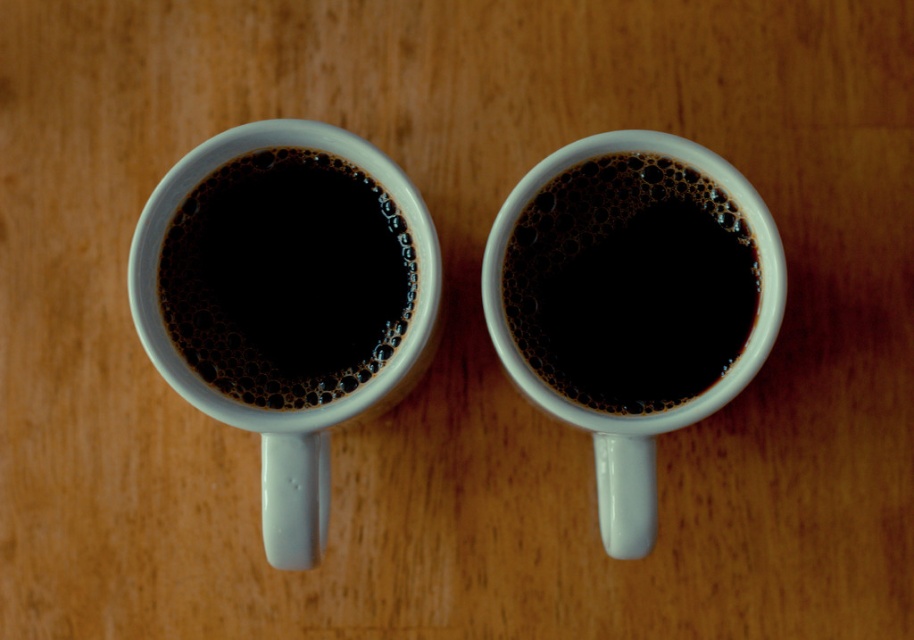
You have two mugs on a table, a white glossy mug at upper center and a matte ceramic coffee cup at center. If you want to pour more coffee into both without spilling, which one can hold more liquid before reaching the brim?

The white glossy mug at upper center might be wider than matte ceramic coffee cup at center, so it can hold more liquid before reaching the brim.

You are setting up a table for a coffee shop and need to arrange the white glossy mug at upper center and the matte ceramic cup at center so that the glossy mug is above the matte one. Is the current arrangement correct?

The white glossy mug at upper center is located below the matte ceramic cup at center, so the current arrangement is incorrect. The glossy mug needs to be placed above the matte ceramic cup at center to meet the requirement.

You have two cups in front of you, a white glossy mug at upper center and a matte ceramic cup at center. You want to place a saucer under the wider one. Which cup should you choose?

The white glossy mug at upper center might be wider than the matte ceramic cup at center, so you should place the saucer under the white glossy mug at upper center.